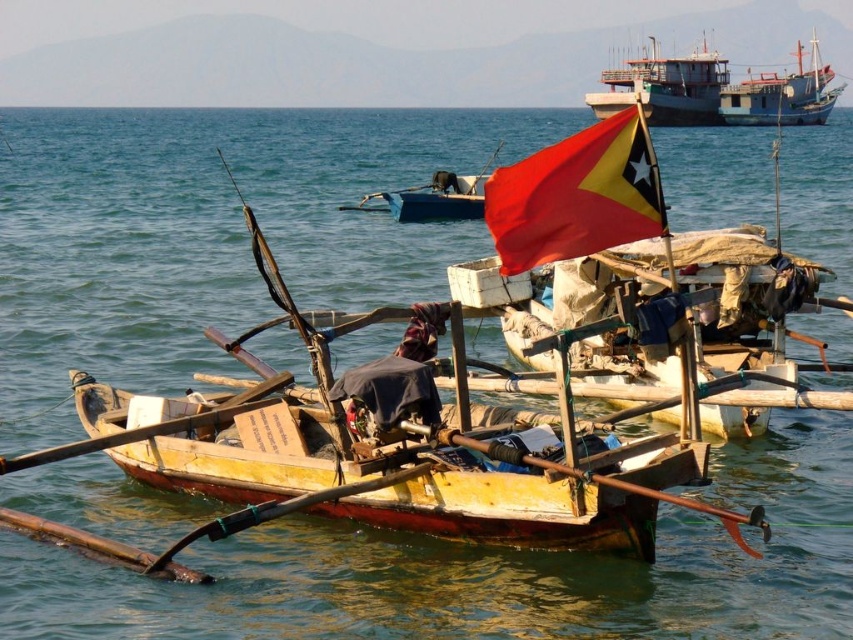
You are standing on the deck of the boat and want to move from the point at coordinates point (700, 330) to the point at coordinates point (204, 416). Which direction should you move?

You should move forward because point (700, 330) is behind point (204, 416), so moving forward from point (700, 330) will take you towards point (204, 416).

You are standing on the dock and see the wooden boat at center and the wooden paddle at lower left. Which object is closer to your right side?

The wooden boat at center is positioned on the right side of wooden paddle at lower left, so the wooden boat at center is closer to your right side.